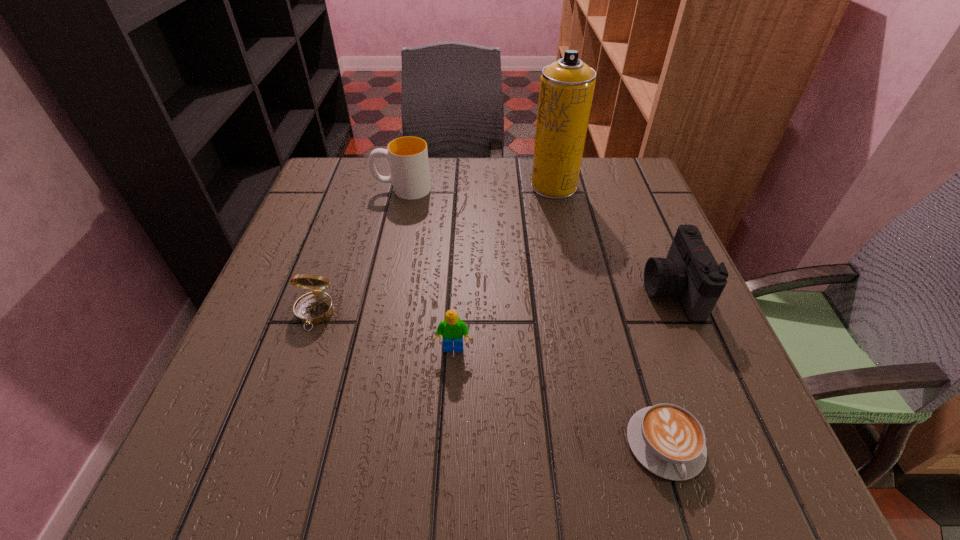
This screenshot has width=960, height=540. In order to click on vacant region at the near left corner in this screenshot , I will do `click(299, 462)`.

This screenshot has width=960, height=540. Find the location of `blank space at the far right corner of the desktop`. blank space at the far right corner of the desktop is located at coordinates (634, 184).

Where is `unoccupied position between the Lego and the camera`? The image size is (960, 540). unoccupied position between the Lego and the camera is located at coordinates (563, 320).

At what (x,y) coordinates should I click in order to perform the action: click on free space between the camera and the cappuccino. Please return your answer as a coordinate pair (x, y). This screenshot has width=960, height=540. Looking at the image, I should click on (668, 368).

Locate an element on the screen. This screenshot has width=960, height=540. free space between the fifth farthest object and the cup is located at coordinates (428, 269).

Identify the location of unoccupied position between the camera and the nearest object. Image resolution: width=960 pixels, height=540 pixels. (668, 368).

Where is `free area in between the camera and the shortest object`? This screenshot has height=540, width=960. free area in between the camera and the shortest object is located at coordinates (668, 368).

I want to click on empty space that is in between the camera and the aerosol can, so click(x=612, y=239).

You are a GUI agent. You are given a task and a screenshot of the screen. Output one action in this format:
    pyautogui.click(x=<x>, y=<y>)
    Task: Click on the free area in between the cup and the fourth object from right to left
    The image size is (960, 540).
    Given the screenshot: What is the action you would take?
    pyautogui.click(x=428, y=269)

Where is `vacant area that lies between the compass and the tallest object`? The image size is (960, 540). vacant area that lies between the compass and the tallest object is located at coordinates pos(434,249).